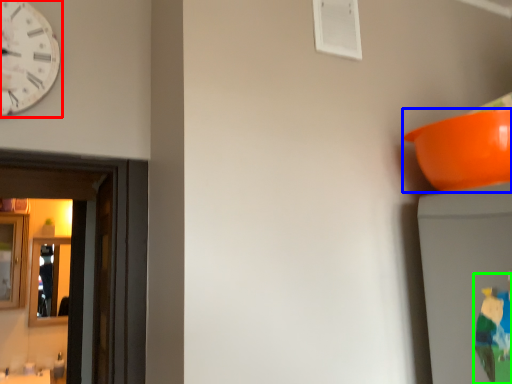
Question: Which object is the closest to the wall clock (highlighted by a red box)? Choose among these: bowl (highlighted by a blue box) or toy (highlighted by a green box).

Choices:
 (A) bowl
 (B) toy

Answer: (A)